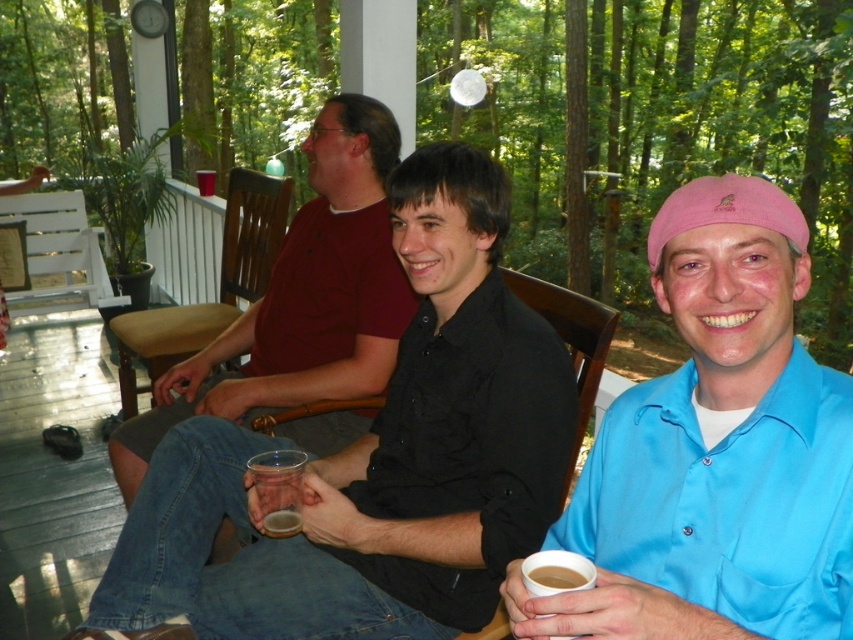
Question: Which object is the closest to the black matte shirt at center?

Choices:
 (A) translucent glass cup at center
 (B) translucent plastic cup at center
 (C) wooden chair at center
 (D) brown matte cup at lower center

Answer: (B)

Question: In this image, where is brown leather chair at center located relative to wooden chair at center?

Choices:
 (A) right
 (B) left

Answer: (B)

Question: Which object is closer to the camera taking this photo?

Choices:
 (A) wooden chair at center
 (B) translucent glass cup at center
 (C) pink fabric cap at upper right
 (D) black matte shirt at center

Answer: (C)

Question: In this image, where is pink fabric cap at upper right located relative to brown matte cup at lower center?

Choices:
 (A) above
 (B) below

Answer: (A)

Question: Which of the following is the closest to the observer?

Choices:
 (A) (543, 292)
 (B) (177, 488)
 (C) (270, 515)
 (D) (352, 182)

Answer: (C)

Question: Does brown leather chair at center appear on the right side of translucent glass cup at center?

Choices:
 (A) no
 (B) yes

Answer: (A)